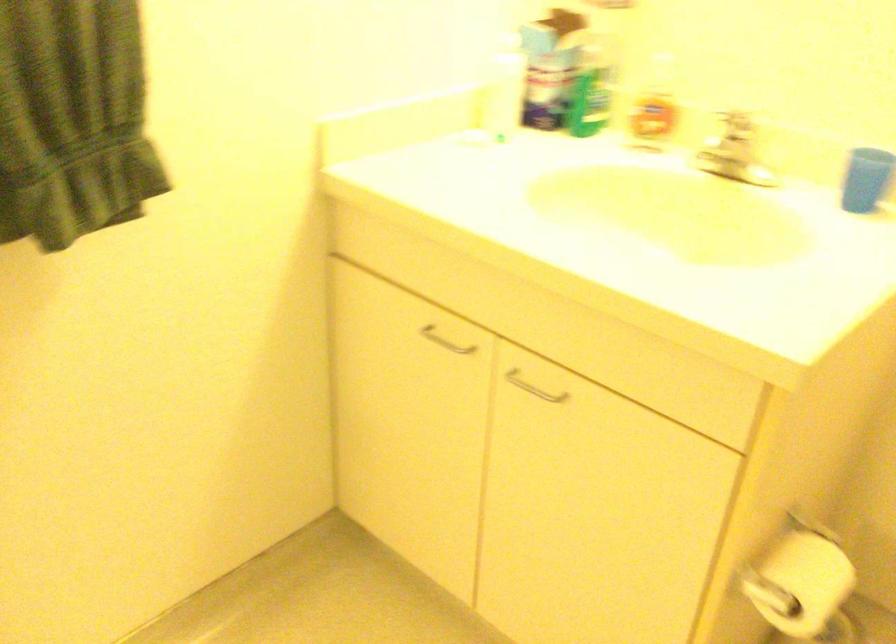
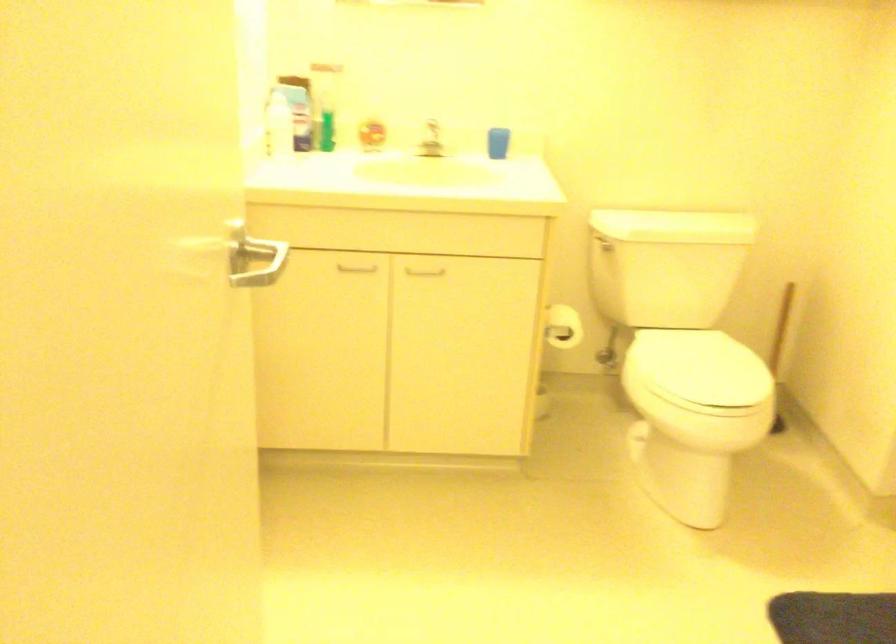
Locate, in the second image, the point that corresponds to point 553,393 in the first image.

(424, 272)